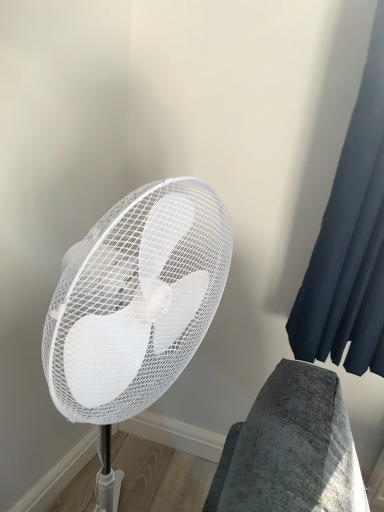
Image resolution: width=384 pixels, height=512 pixels. Describe the element at coordinates (350, 241) in the screenshot. I see `dark blue fabric at right` at that location.

The height and width of the screenshot is (512, 384). In order to click on dark blue fabric at right in this screenshot , I will do `click(350, 241)`.

Measure the distance between white mesh fan at center and camera.

The distance of white mesh fan at center from camera is 19.73 inches.

Describe the element at coordinates (135, 308) in the screenshot. Image resolution: width=384 pixels, height=512 pixels. I see `white mesh fan at center` at that location.

Locate an element on the screen. The height and width of the screenshot is (512, 384). white mesh fan at center is located at coordinates (135, 308).

Locate an element on the screen. This screenshot has height=512, width=384. dark blue fabric at right is located at coordinates (350, 241).

Visually, is white mesh fan at center positioned to the left or to the right of dark blue fabric at right?

In the image, white mesh fan at center appears on the left side of dark blue fabric at right.

Is the depth of white mesh fan at center greater than that of dark blue fabric at right?

No, it is in front of dark blue fabric at right.

Is point (112, 292) closer to camera compared to point (346, 234)?

That is True.

From the image's perspective, between white mesh fan at center and dark blue fabric at right, which one is located above?

dark blue fabric at right appears higher in the image.

From a real-world perspective, is white mesh fan at center physically located above or below dark blue fabric at right?

In terms of real-world spatial position, white mesh fan at center is below dark blue fabric at right.

Considering the sizes of objects white mesh fan at center and dark blue fabric at right in the image provided, who is thinner, white mesh fan at center or dark blue fabric at right?

Thinner between the two is dark blue fabric at right.

Is white mesh fan at center taller or shorter than dark blue fabric at right?

Clearly, white mesh fan at center is taller compared to dark blue fabric at right.

Between white mesh fan at center and dark blue fabric at right, which one has smaller size?

dark blue fabric at right is smaller.

Is white mesh fan at center not within dark blue fabric at right?

Yes.

Is white mesh fan at center not close to dark blue fabric at right?

white mesh fan at center is actually quite close to dark blue fabric at right.

Could you tell me if white mesh fan at center is turned towards dark blue fabric at right?

No, white mesh fan at center is not turned towards dark blue fabric at right.

How different are the orientations of white mesh fan at center and dark blue fabric at right in degrees?

The angle between the facing direction of white mesh fan at center and the facing direction of dark blue fabric at right is 69.6 degrees.

Measure the distance from white mesh fan at center to dark blue fabric at right.

The distance of white mesh fan at center from dark blue fabric at right is 17.36 inches.

What are the coordinates of `curtain on the right of white mesh fan at center` in the screenshot? It's located at (350, 241).

Considering the relative positions of dark blue fabric at right and white mesh fan at center in the image provided, is dark blue fabric at right to the left or to the right of white mesh fan at center?

In the image, dark blue fabric at right appears on the right side of white mesh fan at center.

Consider the image. Does dark blue fabric at right come behind white mesh fan at center?

Yes.

Does point (370, 82) appear closer or farther from the camera than point (129, 224)?

Point (370, 82) appears to be farther away from the viewer than point (129, 224).

From the image's perspective, is dark blue fabric at right located above or below white mesh fan at center?

Based on their image positions, dark blue fabric at right is located above white mesh fan at center.

From a real-world perspective, is dark blue fabric at right over white mesh fan at center?

Yes, from a real-world perspective, dark blue fabric at right is above white mesh fan at center.

Is dark blue fabric at right wider than white mesh fan at center?

No.

Considering the sizes of dark blue fabric at right and white mesh fan at center in the image, is dark blue fabric at right taller or shorter than white mesh fan at center?

Clearly, dark blue fabric at right is shorter compared to white mesh fan at center.

Can you confirm if dark blue fabric at right is smaller than white mesh fan at center?

Indeed, dark blue fabric at right has a smaller size compared to white mesh fan at center.

Is dark blue fabric at right located outside white mesh fan at center?

Yes.

Is dark blue fabric at right not near white mesh fan at center?

dark blue fabric at right is near white mesh fan at center, not far away.

Is dark blue fabric at right turned away from white mesh fan at center?

No, white mesh fan at center is not at the back of dark blue fabric at right.

Consider the image. What's the angular difference between dark blue fabric at right and white mesh fan at center's facing directions?

There is a 69.6-degree angle between the facing directions of dark blue fabric at right and white mesh fan at center.

The image size is (384, 512). In the image, there is a white mesh fan at center. In order to click on curtain above it (from the image's perspective) in this screenshot , I will do `click(350, 241)`.

Identify the location of mechanical fan on the left of dark blue fabric at right. This screenshot has width=384, height=512. (135, 308).

Where is `mechanical fan located below the dark blue fabric at right (from the image's perspective)`? This screenshot has width=384, height=512. mechanical fan located below the dark blue fabric at right (from the image's perspective) is located at coordinates [135, 308].